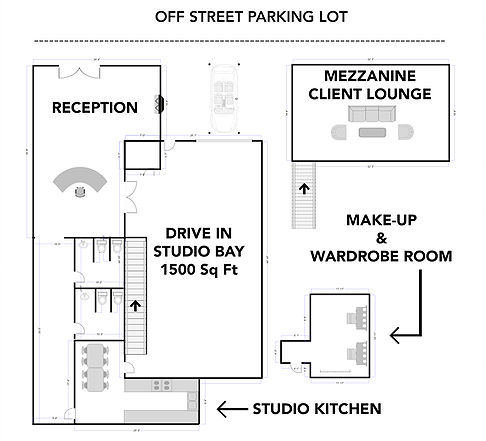
Locate an element on the screen. Image resolution: width=486 pixels, height=441 pixels. toilet is located at coordinates (100, 250), (115, 250), (103, 298), (115, 298).